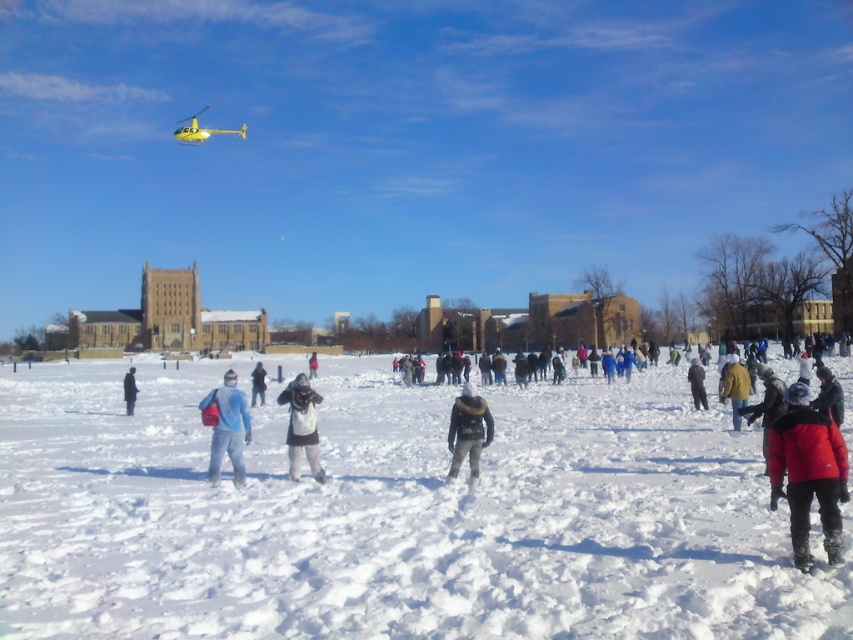
You are a photographer positioned in the center of the snowfield, aiming to capture both the red fleece jacket at lower right and the dark gray wool coat at lower left in a single frame. Based on their heights, which of the two would appear smaller in the photo?

The red fleece jacket at lower right appears smaller in the photo because it is not as tall as the dark gray wool coat at lower left.

You are a photographer trying to capture both the dark gray fabric jacket at center and the dark gray wool coat at lower left in a single photo. Which of the two objects should you focus on first if you want to ensure both are in frame without moving the camera?

You should focus on the dark gray wool coat at lower left first because it is taller than the dark gray fabric jacket at center, so adjusting the frame to include its height will naturally include the shorter jacket as well.